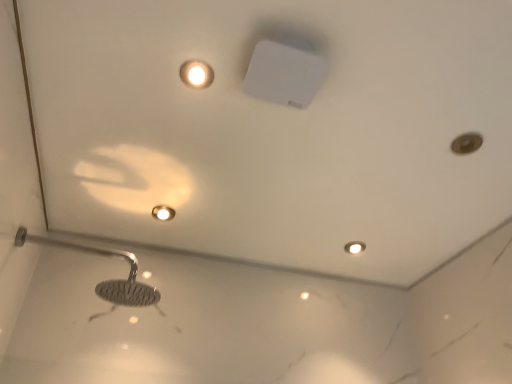
Question: Is matte gold droplight at upper center placed right next to polished chrome shower head at lower left?

Choices:
 (A) no
 (B) yes

Answer: (A)

Question: Does matte gold droplight at upper center lie behind polished chrome shower head at lower left?

Choices:
 (A) yes
 (B) no

Answer: (A)

Question: Is polished chrome shower head at lower left surrounded by matte gold droplight at upper center?

Choices:
 (A) yes
 (B) no

Answer: (B)

Question: Considering the relative sizes of matte gold droplight at upper center and polished chrome shower head at lower left in the image provided, is matte gold droplight at upper center wider than polished chrome shower head at lower left?

Choices:
 (A) no
 (B) yes

Answer: (A)

Question: Is matte gold droplight at upper center taller than polished chrome shower head at lower left?

Choices:
 (A) no
 (B) yes

Answer: (A)

Question: Is point (124, 292) positioned closer to the camera than point (356, 241)?

Choices:
 (A) farther
 (B) closer

Answer: (B)

Question: Visually, is polished chrome shower head at lower left positioned to the left or to the right of matte white light fixture at bottom right?

Choices:
 (A) right
 (B) left

Answer: (B)

Question: Is polished chrome shower head at lower left inside the boundaries of matte white light fixture at bottom right, or outside?

Choices:
 (A) outside
 (B) inside

Answer: (A)

Question: From the image's perspective, relative to matte white light fixture at bottom right, is polished chrome shower head at lower left above or below?

Choices:
 (A) above
 (B) below

Answer: (A)

Question: Is point (346, 244) closer or farther from the camera than point (144, 284)?

Choices:
 (A) farther
 (B) closer

Answer: (A)

Question: From the image's perspective, is matte white light fixture at bottom right positioned above or below polished chrome shower head at lower left?

Choices:
 (A) below
 (B) above

Answer: (A)

Question: Considering the positions of matte white light fixture at bottom right and polished chrome shower head at lower left in the image, is matte white light fixture at bottom right bigger or smaller than polished chrome shower head at lower left?

Choices:
 (A) big
 (B) small

Answer: (B)

Question: In terms of width, does matte white light fixture at bottom right look wider or thinner when compared to polished chrome shower head at lower left?

Choices:
 (A) wide
 (B) thin

Answer: (B)

Question: Is matte gold droplight at upper center to the left or to the right of matte white light fixture at bottom right in the image?

Choices:
 (A) right
 (B) left

Answer: (B)

Question: From the image's perspective, is matte gold droplight at upper center above or below matte white light fixture at bottom right?

Choices:
 (A) above
 (B) below

Answer: (A)